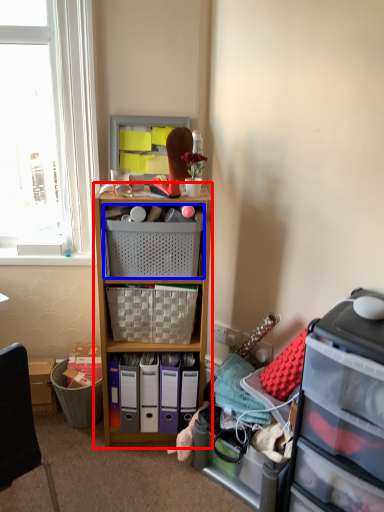
Question: Among these objects, which one is nearest to the camera, cabinetry (highlighted by a red box) or picnic basket (highlighted by a blue box)?

Choices:
 (A) cabinetry
 (B) picnic basket

Answer: (A)